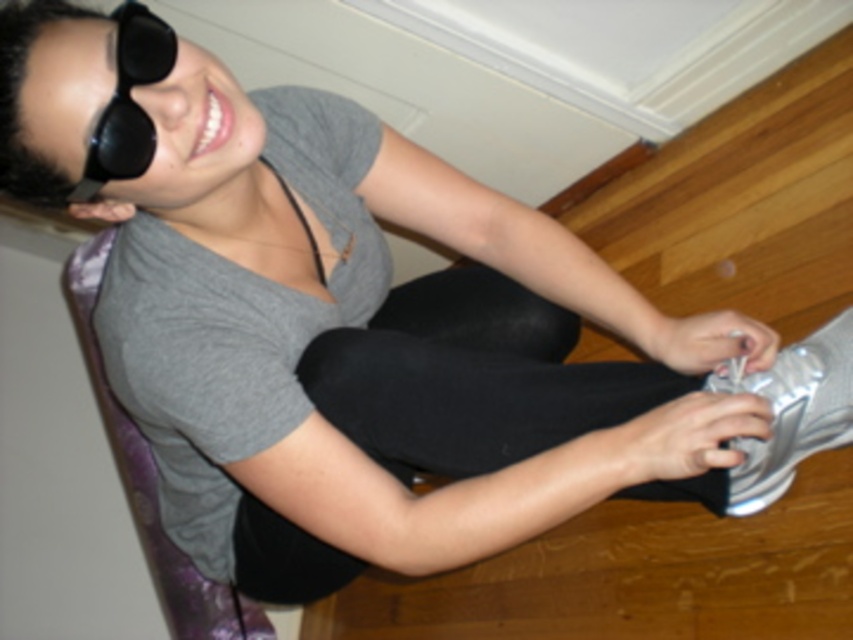
Who is positioned more to the right, matte gray shirt at upper left or black matte sunglasses at upper left?

From the viewer's perspective, matte gray shirt at upper left appears more on the right side.

Does point (300, 138) come in front of point (132, 76)?

No, it is not.

The height and width of the screenshot is (640, 853). I want to click on matte gray shirt at upper left, so click(x=236, y=323).

Is point (381, 452) less distant than point (146, 77)?

No, (381, 452) is further to viewer.

Between point (416, 464) and point (142, 77), which one is positioned behind?

Positioned behind is point (416, 464).

Is point (332, 378) positioned after point (167, 40)?

Yes, point (332, 378) is farther from viewer.

Locate an element on the screen. This screenshot has width=853, height=640. black matte leggings at center is located at coordinates (469, 378).

Does matte gray shirt at upper left have a greater height compared to silver metallic shoe at lower right?

Indeed, matte gray shirt at upper left has a greater height compared to silver metallic shoe at lower right.

In the scene shown: Is matte gray shirt at upper left in front of silver metallic shoe at lower right?

Yes, matte gray shirt at upper left is in front of silver metallic shoe at lower right.

At what (x,y) coordinates should I click in order to perform the action: click on matte gray shirt at upper left. Please return your answer as a coordinate pair (x, y). Image resolution: width=853 pixels, height=640 pixels. Looking at the image, I should click on (236, 323).